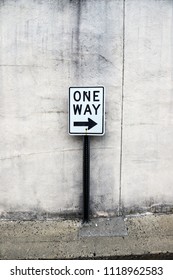
This screenshot has height=280, width=173. In order to click on floor in this screenshot , I will do (x=137, y=228).